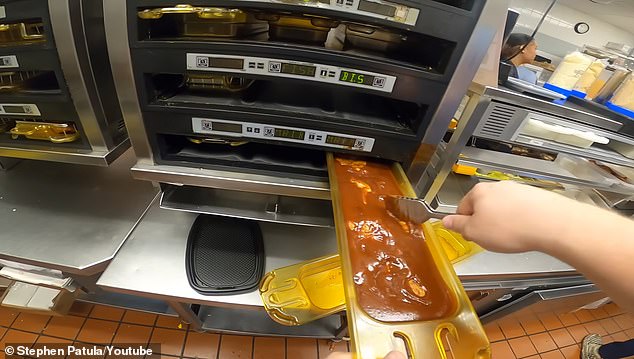
The image size is (634, 359). I want to click on sauce pan, so click(383, 342).